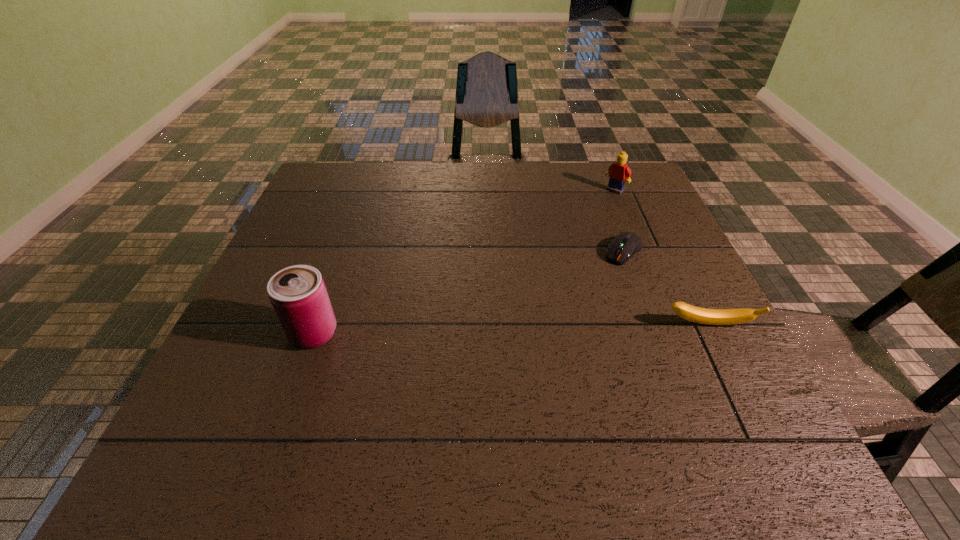
Locate an element on the screen. vacant position in the image that satisfies the following two spatial constraints: 1. on the back side of the leftmost object; 2. on the left side of the computer equipment is located at coordinates (343, 252).

Find the location of `vacant region that satisfies the following two spatial constraints: 1. on the back side of the shortest object; 2. on the left side of the farthest object`. vacant region that satisfies the following two spatial constraints: 1. on the back side of the shortest object; 2. on the left side of the farthest object is located at coordinates (600, 191).

At what (x,y) coordinates should I click in order to perform the action: click on vacant space that satisfies the following two spatial constraints: 1. on the back side of the tallest object; 2. on the right side of the third nearest object. Please return your answer as a coordinate pair (x, y). Looking at the image, I should click on (343, 252).